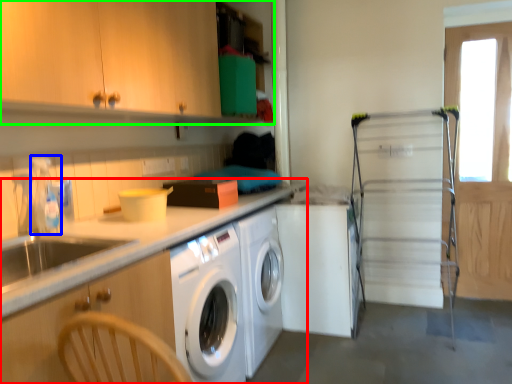
Question: Considering the real-world distances, which object is farthest from countertop (highlighted by a red box)? faucet (highlighted by a blue box) or cabinetry (highlighted by a green box)?

Choices:
 (A) faucet
 (B) cabinetry

Answer: (B)